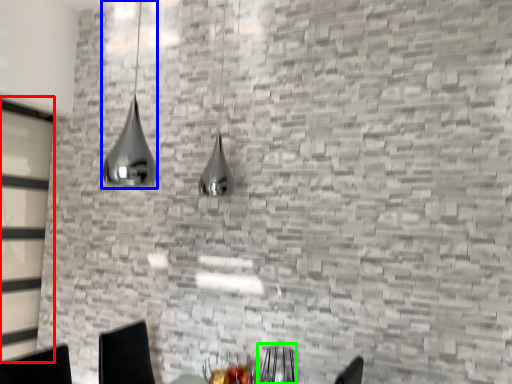
Question: Considering the real-world distances, which object is closest to glass door (highlighted by a red box)? lamp (highlighted by a blue box) or armchair (highlighted by a green box).

Choices:
 (A) lamp
 (B) armchair

Answer: (A)